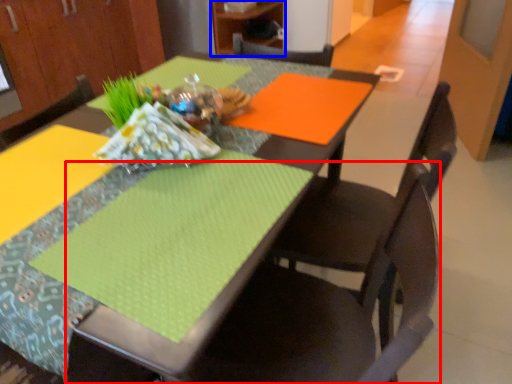
Question: Which object is further to the camera taking this photo, chair (highlighted by a red box) or cabinetry (highlighted by a blue box)?

Choices:
 (A) chair
 (B) cabinetry

Answer: (B)